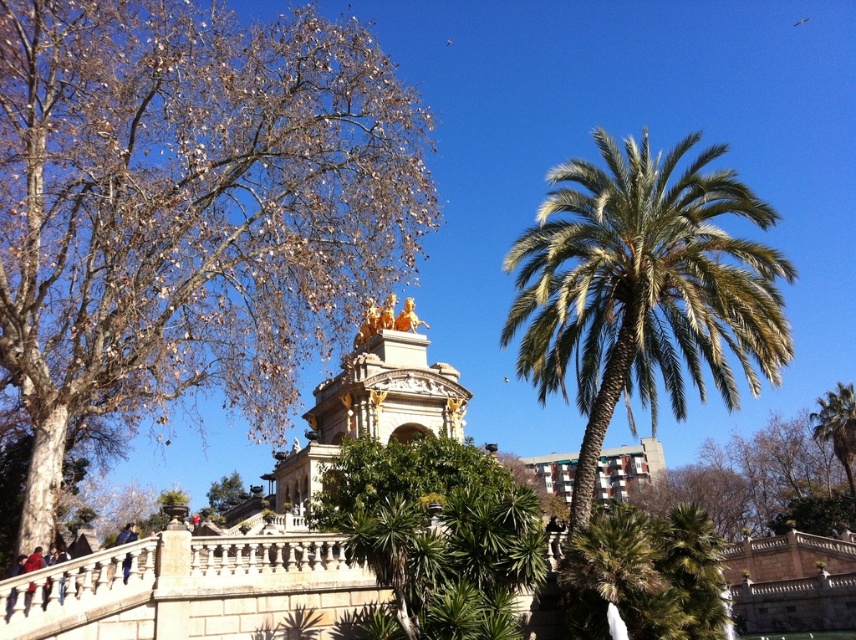
Based on the photo, between brown bark tree at upper left and green leafy palm tree at right, which one is positioned lower?

Positioned lower is green leafy palm tree at right.

Who is taller, brown bark tree at upper left or green leafy palm tree at right?

brown bark tree at upper left

Is point (167, 289) farther from camera compared to point (819, 403)?

No.

The width and height of the screenshot is (856, 640). In order to click on brown bark tree at upper left in this screenshot , I will do `click(188, 209)`.

Identify the location of brown bark tree at upper left. (188, 209).

Which is behind, point (61, 380) or point (652, 364)?

The point (61, 380) is behind.

Who is more distant from viewer, (256, 288) or (616, 339)?

Positioned behind is point (256, 288).

This screenshot has width=856, height=640. Find the location of `brown bark tree at upper left`. brown bark tree at upper left is located at coordinates [x=188, y=209].

Between green leafy palm at center and green leafy palm tree at right, which one has less height?

green leafy palm tree at right is shorter.

Can you confirm if green leafy palm at center is shorter than green leafy palm tree at right?

No, green leafy palm at center is not shorter than green leafy palm tree at right.

Locate an element on the screen. green leafy palm at center is located at coordinates (643, 289).